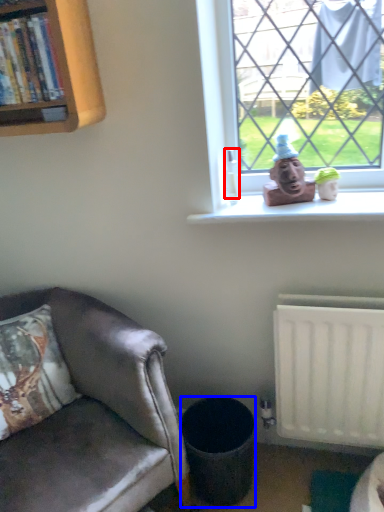
Question: Among these objects, which one is farthest to the camera, coffee cup (highlighted by a red box) or trash bin/can (highlighted by a blue box)?

Choices:
 (A) coffee cup
 (B) trash bin/can

Answer: (A)